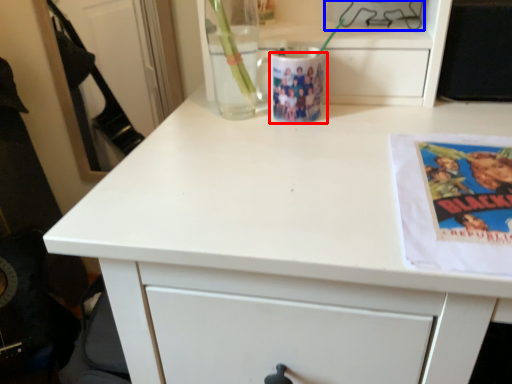
Question: Which of the following is the closest to the observer, mug (highlighted by a red box) or appliance (highlighted by a blue box)?

Choices:
 (A) mug
 (B) appliance

Answer: (A)